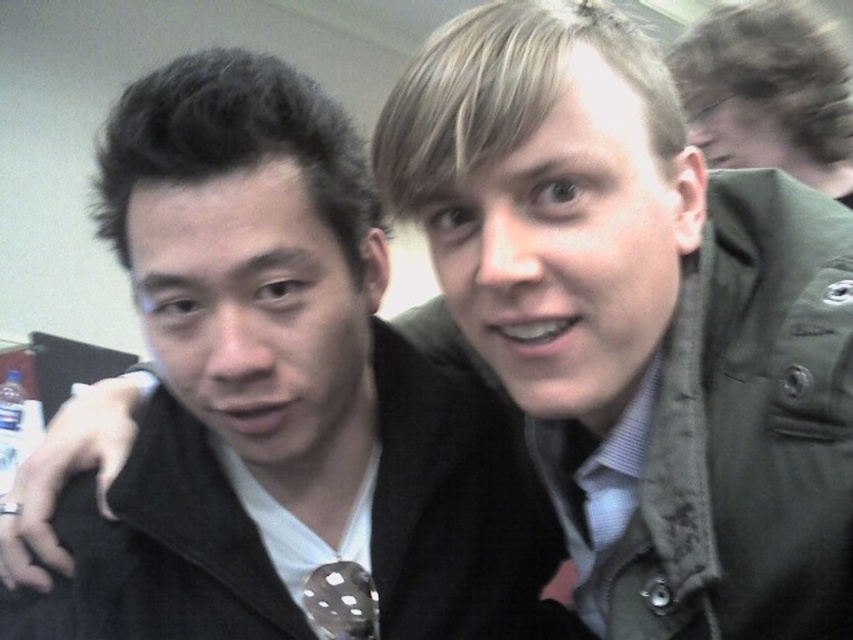
Question: Which point appears closest to the camera in this image?

Choices:
 (A) (757, 49)
 (B) (323, 630)

Answer: (B)

Question: Is dark green jacket at upper right wider than white dotted fabric tie at center?

Choices:
 (A) no
 (B) yes

Answer: (B)

Question: Among these points, which one is nearest to the camera?

Choices:
 (A) (311, 588)
 (B) (258, 637)

Answer: (B)

Question: Which point is closer to the camera?

Choices:
 (A) white dotted fabric tie at center
 (B) matte black jacket at center

Answer: (B)

Question: Where is matte black jacket at center located in relation to white dotted fabric tie at center in the image?

Choices:
 (A) below
 (B) above

Answer: (B)

Question: In this image, where is matte black jacket at center located relative to white dotted fabric tie at center?

Choices:
 (A) below
 (B) above

Answer: (B)